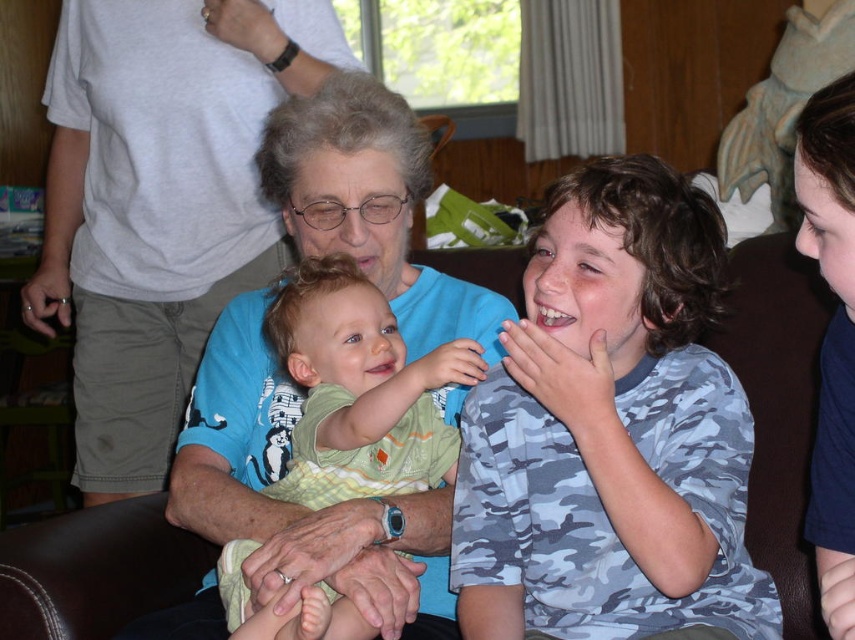
Between camouflage fabric shirt at center and green cotton shirt at center, which one is positioned lower?

green cotton shirt at center is lower down.

Between camouflage fabric shirt at center and green cotton shirt at center, which one has more height?

camouflage fabric shirt at center is taller.

Image resolution: width=855 pixels, height=640 pixels. I want to click on camouflage fabric shirt at center, so click(610, 433).

Can you confirm if light blue shirt at center is smaller than green cotton shirt at center?

No.

Can you confirm if light blue shirt at center is wider than green cotton shirt at center?

Yes, light blue shirt at center is wider than green cotton shirt at center.

Between point (122, 28) and point (416, 417), which one is positioned behind?

Point (122, 28)

Find the location of a particular element. The width and height of the screenshot is (855, 640). light blue shirt at center is located at coordinates (158, 202).

Which is in front, point (738, 426) or point (161, 440)?

Positioned in front is point (738, 426).

Is camouflage fabric shirt at center thinner than light blue shirt at center?

Correct, camouflage fabric shirt at center's width is less than light blue shirt at center's.

Image resolution: width=855 pixels, height=640 pixels. Find the location of `camouflage fabric shirt at center`. camouflage fabric shirt at center is located at coordinates (610, 433).

The height and width of the screenshot is (640, 855). Identify the location of camouflage fabric shirt at center. (610, 433).